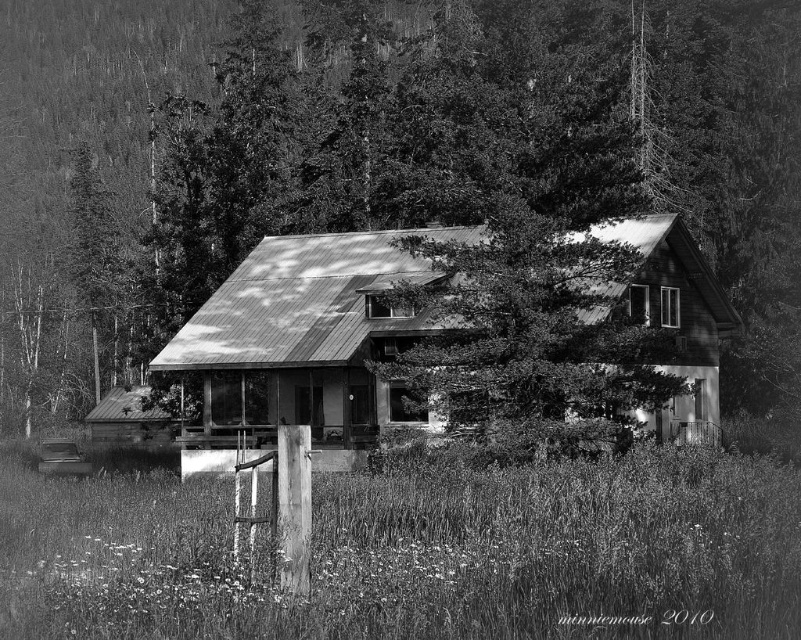
You are a hiker who wants to take a photo of the smooth bark tree at center and the rusty metal cabin at center. Which one should you focus on if you want both objects to be in sharp focus?

The smooth bark tree at center has a larger size compared to the rusty metal cabin at center, so you should focus on the tree to ensure both are in sharp focus.

You are standing in front of the house and want to walk from the smooth bark tree at center to the rusty metal cabin at center. Which direction should you move relative to the tree to reach the cabin?

The smooth bark tree at center is closer to you than the rusty metal cabin at center, so you should move away from the tree towards the cabin which is further back in the scene.